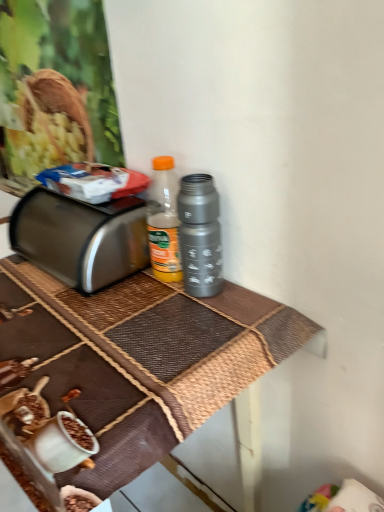
Find the location of a particular element. The height and width of the screenshot is (512, 384). free space above metallic brown table at center (from a real-world perspective) is located at coordinates (86, 311).